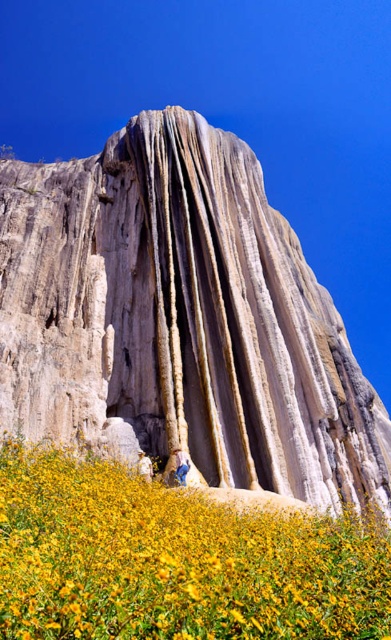
Can you confirm if white textured rock at center is shorter than yellow matte flower at lower center?

No, white textured rock at center is not shorter than yellow matte flower at lower center.

Is white textured rock at center thinner than yellow matte flower at lower center?

No.

Identify the location of white textured rock at center. This screenshot has height=640, width=391. (181, 323).

Locate an element on the screen. The width and height of the screenshot is (391, 640). white textured rock at center is located at coordinates (181, 323).